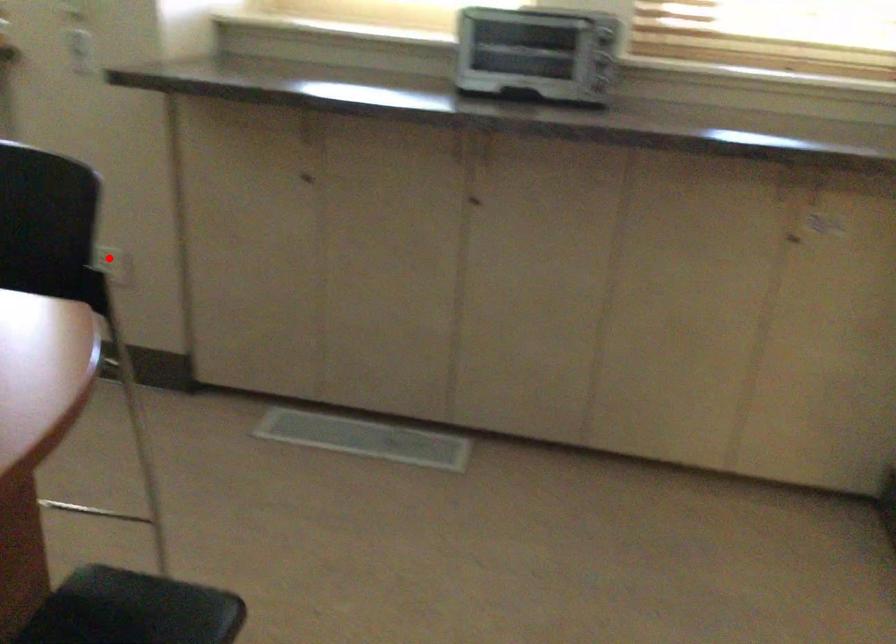
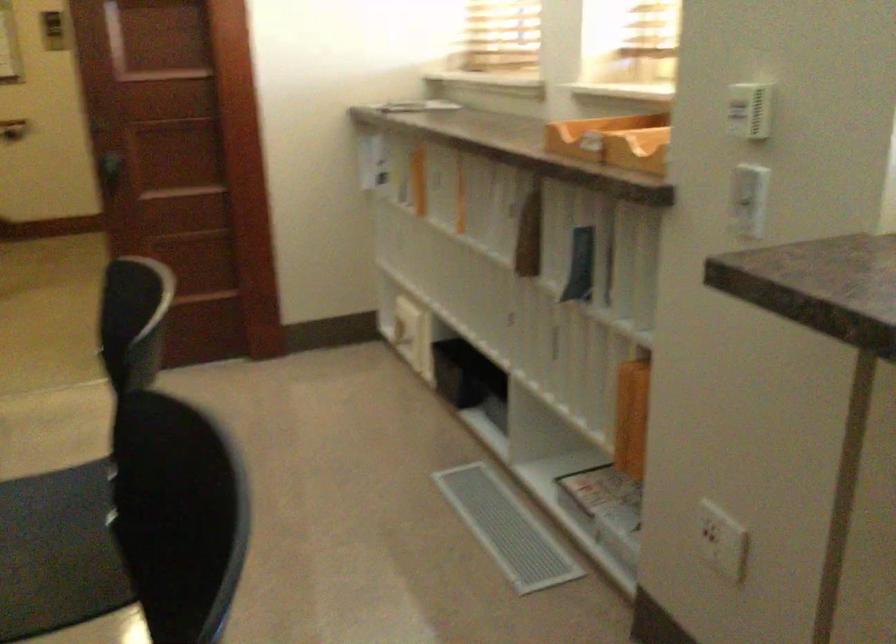
In the second image, find the point that corresponds to the highlighted location in the first image.

(721, 541)